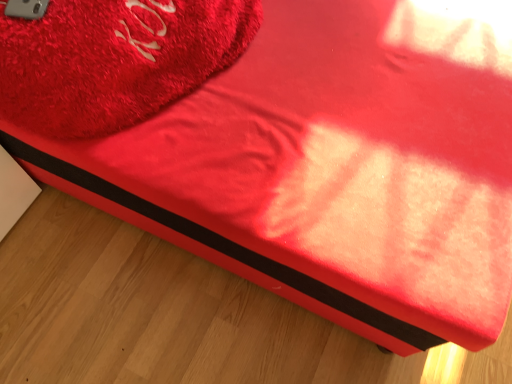
This screenshot has width=512, height=384. Identify the location of velvety red bean bag at upper left. (113, 59).

What do you see at coordinates (113, 59) in the screenshot?
I see `velvety red bean bag at upper left` at bounding box center [113, 59].

Locate an element on the screen. velvety red bean bag at upper left is located at coordinates (113, 59).